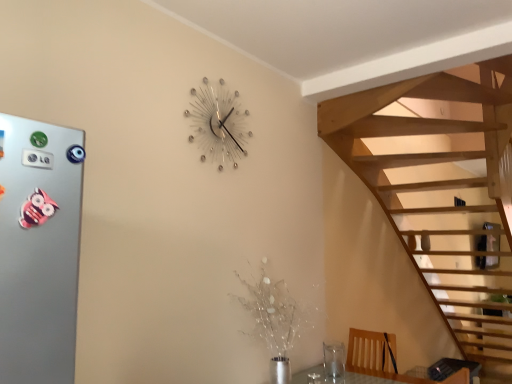
Question: Would you say metallic silver wall clock at upper center is inside or outside silver metallic button at left?

Choices:
 (A) inside
 (B) outside

Answer: (B)

Question: From a real-world perspective, relative to silver metallic button at left, is metallic silver wall clock at upper center vertically above or below?

Choices:
 (A) above
 (B) below

Answer: (A)

Question: Which object is positioned farthest from the transparent glass vase at lower right?

Choices:
 (A) silver metallic button at left
 (B) metallic silver wall clock at upper center

Answer: (A)

Question: Estimate the real-world distances between objects in this image. Which object is closer to the transparent glass vase at lower right?

Choices:
 (A) silver metallic button at left
 (B) metallic silver wall clock at upper center

Answer: (B)